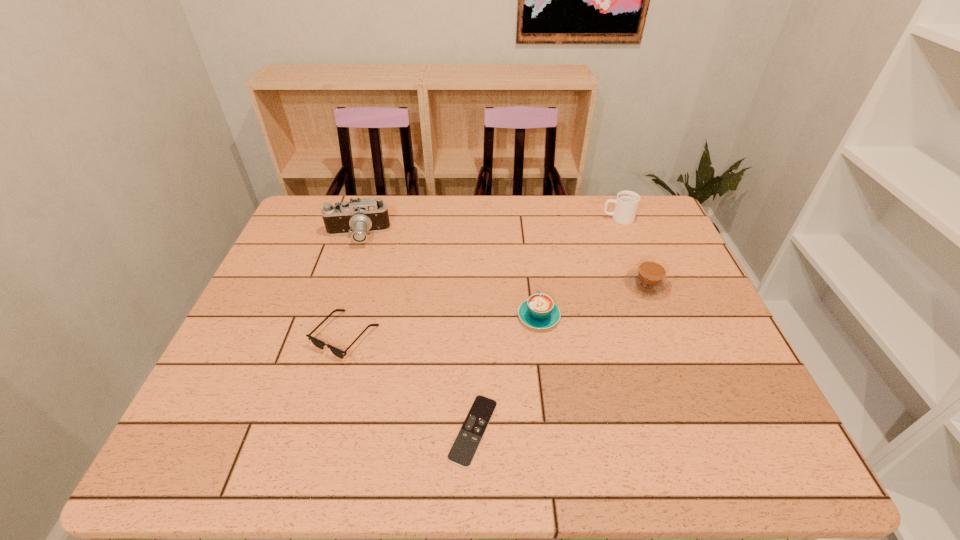
Find the location of a particular element. Image resolution: width=960 pixels, height=540 pixels. the tallest object is located at coordinates (357, 218).

The image size is (960, 540). Identify the location of the fifth shortest object. click(x=626, y=203).

You are a GUI agent. You are given a task and a screenshot of the screen. Output one action in this format:
    pyautogui.click(x=<x>, y=<y>)
    Task: Click on the farthest cappuccino
    Image resolution: width=960 pixels, height=540 pixels.
    Given the screenshot: What is the action you would take?
    pyautogui.click(x=626, y=203)

The height and width of the screenshot is (540, 960). What are the coordinates of `the second nearest cappuccino` in the screenshot? It's located at (649, 279).

At what (x,y) coordinates should I click in order to perform the action: click on the third tallest object. Please return your answer as a coordinate pair (x, y). The width and height of the screenshot is (960, 540). Looking at the image, I should click on (649, 279).

Locate an element on the screen. the nearest cappuccino is located at coordinates (539, 311).

Locate an element on the screen. the fourth object from left to right is located at coordinates (539, 311).

Locate an element on the screen. This screenshot has width=960, height=540. the fifth tallest object is located at coordinates (316, 342).

I want to click on remote control, so click(462, 452).

The image size is (960, 540). Find the location of `the fourth object from right to left`. the fourth object from right to left is located at coordinates (462, 452).